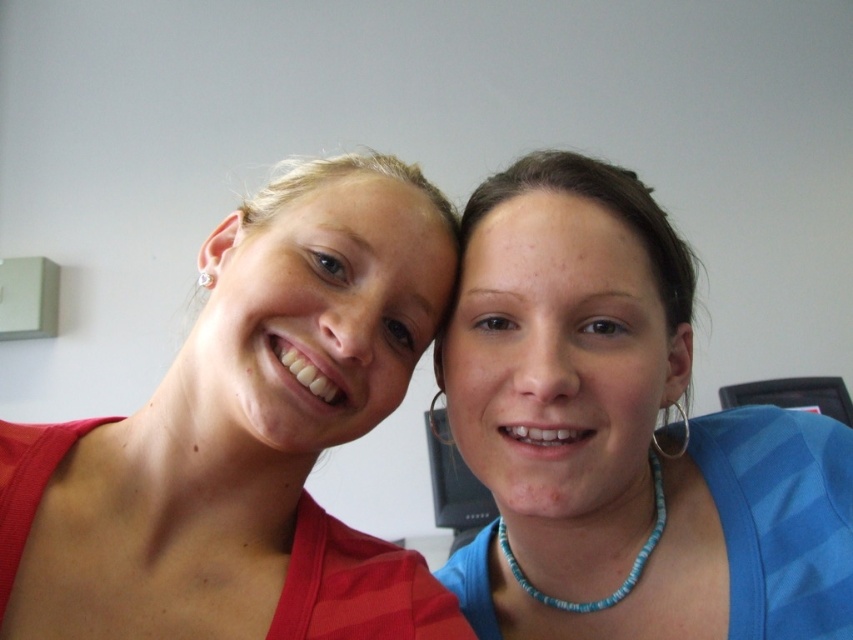
Question: Among these objects, which one is nearest to the camera?

Choices:
 (A) blue beaded necklace at upper right
 (B) blue beaded necklace at lower center
 (C) red striped dress at left
 (D) matte red shirt at left

Answer: (A)

Question: Can you confirm if blue beaded necklace at upper right is smaller than blue beaded necklace at lower center?

Choices:
 (A) no
 (B) yes

Answer: (A)

Question: Does red striped dress at left appear on the right side of blue beaded necklace at lower center?

Choices:
 (A) no
 (B) yes

Answer: (A)

Question: Is matte red shirt at left in front of blue beaded necklace at lower center?

Choices:
 (A) yes
 (B) no

Answer: (A)

Question: Which object appears farthest from the camera in this image?

Choices:
 (A) red striped dress at left
 (B) matte red shirt at left
 (C) blue beaded necklace at upper right

Answer: (A)

Question: Which of the following is the closest to the observer?

Choices:
 (A) matte red shirt at left
 (B) red striped dress at left
 (C) blue beaded necklace at lower center

Answer: (A)